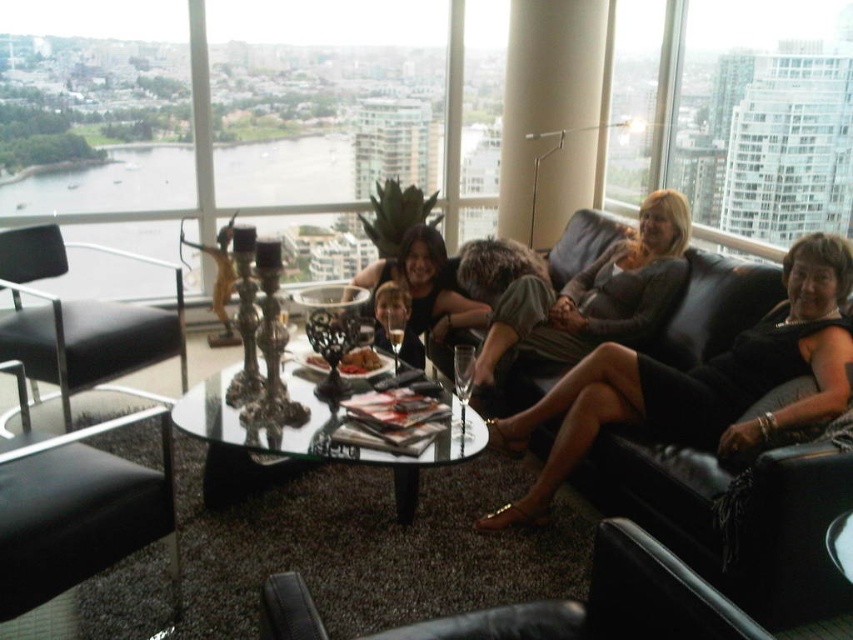
Which is in front, point (811, 312) or point (421, 346)?

Positioned in front is point (811, 312).

Where is `black leather dress at right`? Image resolution: width=853 pixels, height=640 pixels. black leather dress at right is located at coordinates (701, 381).

Measure the distance between black leather dress at right and camera.

A: A distance of 2.22 meters exists between black leather dress at right and camera.

You are a GUI agent. You are given a task and a screenshot of the screen. Output one action in this format:
    pyautogui.click(x=<x>, y=<y>)
    Task: Click on the black leather dress at right
    This screenshot has height=640, width=853.
    Given the screenshot: What is the action you would take?
    pyautogui.click(x=701, y=381)

Is black leather armchair at lower left bigger than black leather armchair at lower center?

Indeed, black leather armchair at lower left has a larger size compared to black leather armchair at lower center.

Which is behind, point (160, 476) or point (704, 589)?

The point (160, 476) is behind.

Where is `black leather armchair at lower left`? The image size is (853, 640). black leather armchair at lower left is located at coordinates (76, 508).

From the picture: Between black leather armchair at left and matte black dress at center, which one has more height?

Standing taller between the two is black leather armchair at left.

Can you confirm if black leather armchair at left is bigger than matte black dress at center?

Yes.

Where is `black leather armchair at left`? The image size is (853, 640). black leather armchair at left is located at coordinates (80, 323).